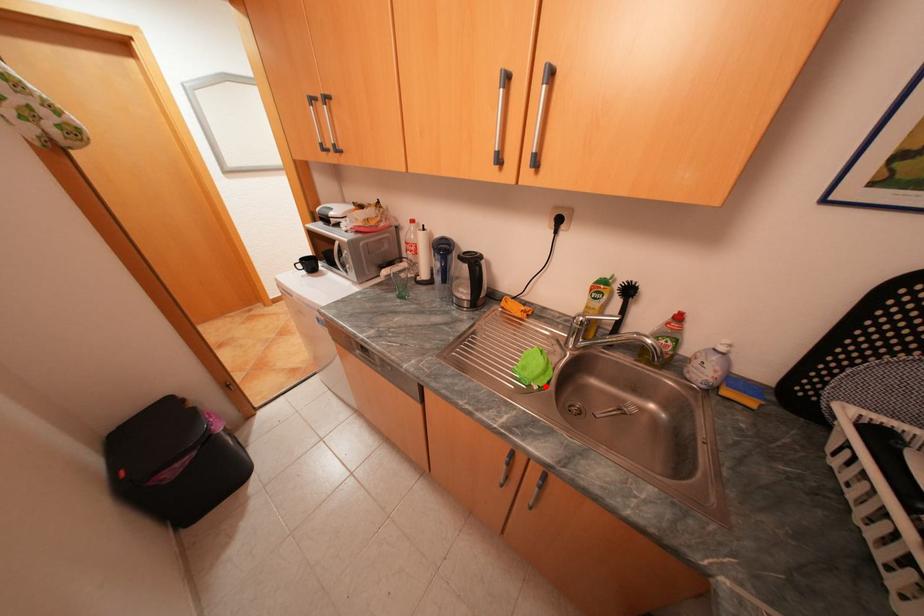
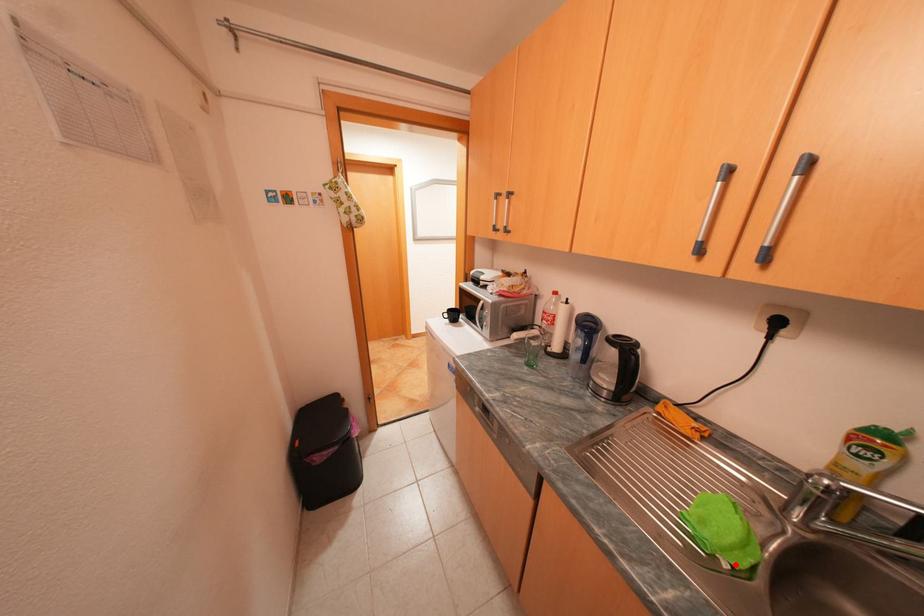
I am providing you with two images of the same scene from different viewpoints. A red point is marked on the first image and another point is marked on the second image. Is the red point in image1 aligned with the point shown in image2?

Yes